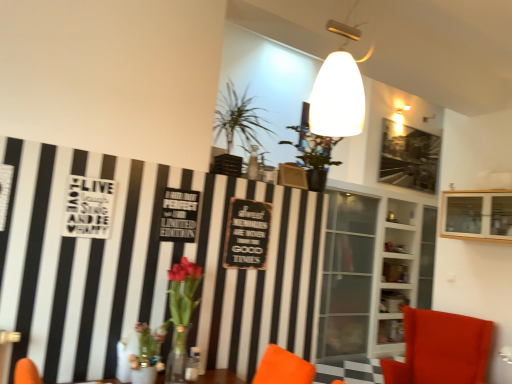
Question: Looking at their shapes, would you say translucent glass vase at lower left is wider or thinner than velvet orange chair at lower right?

Choices:
 (A) thin
 (B) wide

Answer: (A)

Question: Considering their positions, is translucent glass vase at lower left located in front of or behind velvet orange chair at lower right?

Choices:
 (A) front
 (B) behind

Answer: (A)

Question: Considering the real-world distances, which object is farthest from the velvet orange chair at lower right?

Choices:
 (A) wooden cabinet at upper right, the 1th shelf from the front
 (B) translucent glass vase at lower left
 (C) wooden signboard at center
 (D) white glass shelves at center, which is the first shelf from back to front
 (E) green leafy plant at upper center

Answer: (E)

Question: Based on their relative distances, which object is nearer to the green leafy plant at upper center?

Choices:
 (A) wooden cabinet at upper right, which ranks as the 2th shelf in back-to-front order
 (B) white glass shelves at center, which is the first shelf from back to front
 (C) translucent glass vase at lower left
 (D) velvet orange chair at lower right
 (E) wooden signboard at center

Answer: (E)